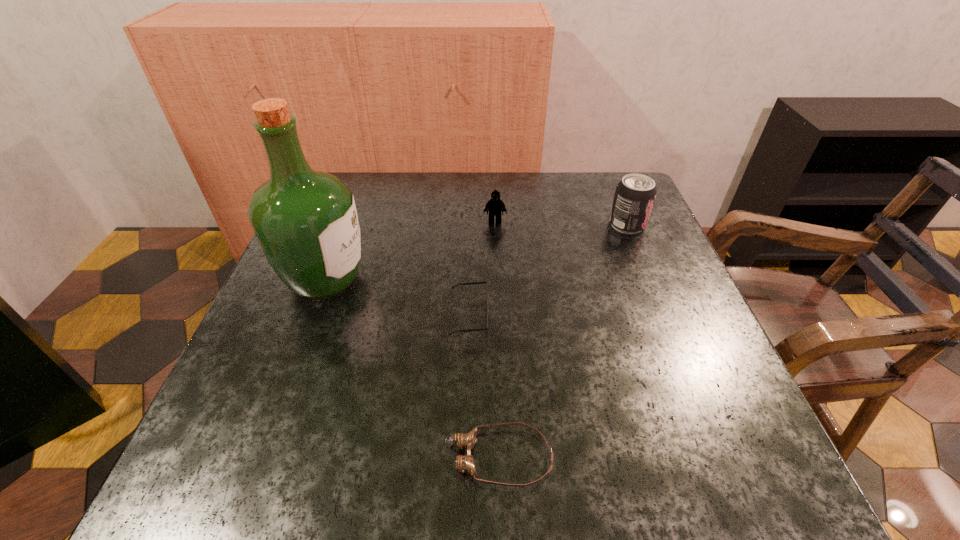
The height and width of the screenshot is (540, 960). I want to click on object located in the far right corner section of the desktop, so click(x=634, y=197).

In the image, there is a desktop. Identify the location of vacant space at the far edge. (486, 181).

Where is `vacant point at the near edge`? This screenshot has width=960, height=540. vacant point at the near edge is located at coordinates (471, 475).

The height and width of the screenshot is (540, 960). In the image, there is a desktop. In order to click on vacant region at the left edge in this screenshot , I will do `click(277, 375)`.

This screenshot has width=960, height=540. In the image, there is a desktop. Find the location of `vacant space at the right edge`. vacant space at the right edge is located at coordinates (625, 287).

At what (x,y) coordinates should I click in order to perform the action: click on vacant space at the far left corner of the desktop. Please return your answer as a coordinate pair (x, y). The image size is (960, 540). Looking at the image, I should click on coord(362,218).

This screenshot has width=960, height=540. In order to click on vacant area at the near left corner in this screenshot , I will do `click(232, 467)`.

What are the coordinates of `unoccupied position between the sunglasses and the leftmost object` in the screenshot? It's located at (397, 298).

Find the location of a particular element. This screenshot has width=960, height=540. unoccupied area between the third tallest object and the rightmost object is located at coordinates (561, 223).

Identify the location of free area in between the leftmost object and the sunglasses. This screenshot has height=540, width=960. (397, 298).